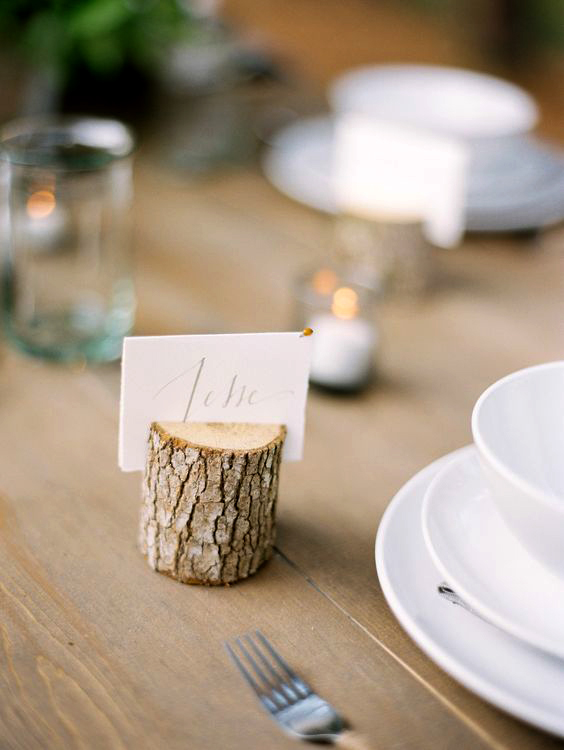
I want to click on plant, so [68, 48].